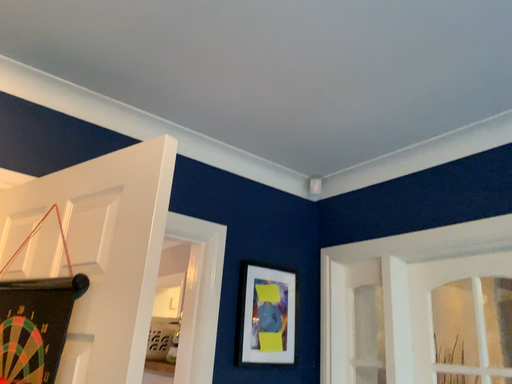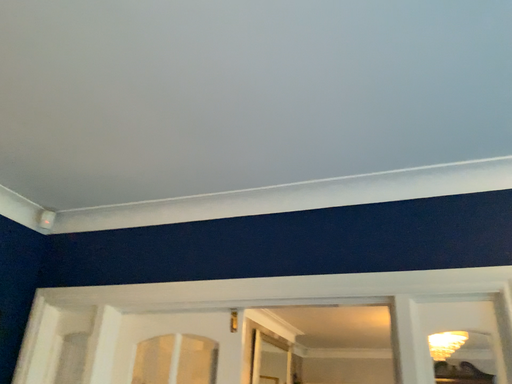
Question: How did the camera likely rotate when shooting the video?

Choices:
 (A) rotated left
 (B) rotated right

Answer: (B)